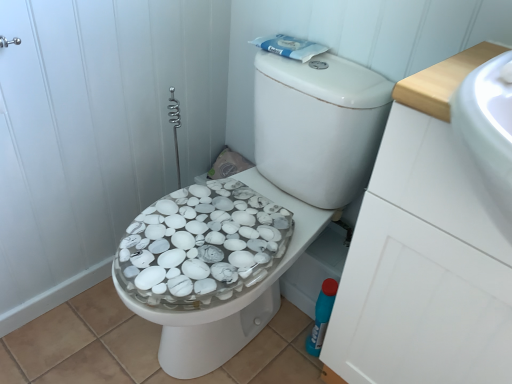
Question: Does white marble bidet at center turn towards white glossy drawer at right?

Choices:
 (A) no
 (B) yes

Answer: (A)

Question: Is white marble bidet at center placed right next to white glossy drawer at right?

Choices:
 (A) no
 (B) yes

Answer: (A)

Question: Does white marble bidet at center have a lesser height compared to white glossy drawer at right?

Choices:
 (A) no
 (B) yes

Answer: (B)

Question: From a real-world perspective, is white marble bidet at center located beneath white glossy drawer at right?

Choices:
 (A) no
 (B) yes

Answer: (B)

Question: From the image's perspective, is white marble bidet at center below white glossy drawer at right?

Choices:
 (A) yes
 (B) no

Answer: (A)

Question: Can you confirm if white marble bidet at center is bigger than white glossy drawer at right?

Choices:
 (A) yes
 (B) no

Answer: (B)

Question: Considering the relative sizes of white glossy drawer at right and white marble bidet at center in the image provided, is white glossy drawer at right shorter than white marble bidet at center?

Choices:
 (A) no
 (B) yes

Answer: (A)

Question: From a real-world perspective, is white glossy drawer at right physically above white marble bidet at center?

Choices:
 (A) yes
 (B) no

Answer: (A)

Question: Does white glossy drawer at right have a lesser width compared to white marble bidet at center?

Choices:
 (A) no
 (B) yes

Answer: (B)

Question: Is white marble bidet at center surrounded by white glossy drawer at right?

Choices:
 (A) yes
 (B) no

Answer: (B)

Question: From a real-world perspective, is white glossy drawer at right positioned under white marble bidet at center based on gravity?

Choices:
 (A) yes
 (B) no

Answer: (B)

Question: Would you say white glossy drawer at right is a long distance from white marble bidet at center?

Choices:
 (A) yes
 (B) no

Answer: (B)

Question: In terms of height, does white marble bidet at center look taller or shorter compared to white glossy drawer at right?

Choices:
 (A) short
 (B) tall

Answer: (A)